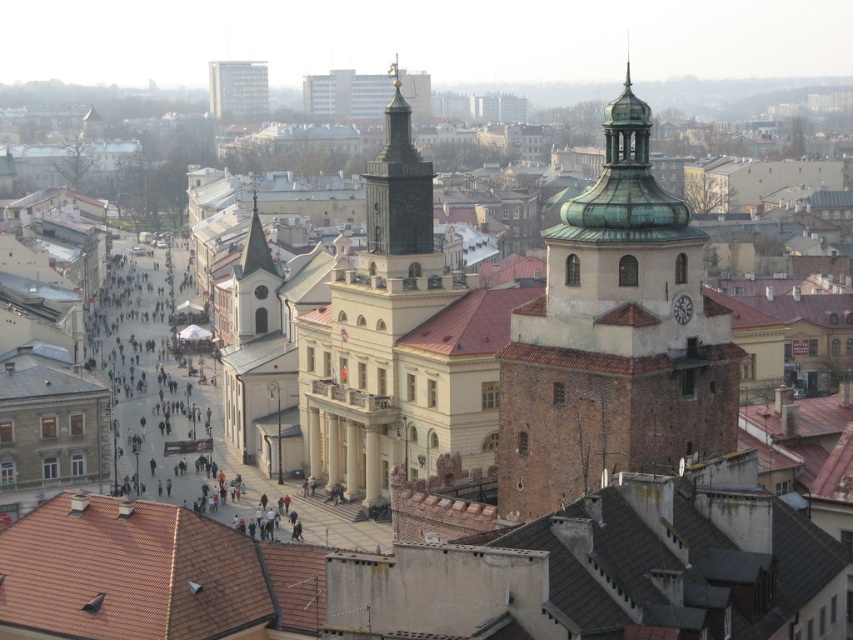
You are a tourist standing in the city square and want to take a photo of both the dark gray stone clock tower at center and the smooth white spire at upper left. Can you capture both in the same frame without moving your camera position?

Yes, the dark gray stone clock tower at center is in front of the smooth white spire at upper left, so you can include both in the same frame by positioning the clock tower in the foreground and the spire visible behind it.

You are an architect analyzing the cityscape. You notice the green copper dome at center right and the matte gray building at upper center. Which of these two structures has a more prominent visual presence in the scene?

The green copper dome at center right has a more prominent visual presence because it is larger in size than the matte gray building at upper center.

You are standing at the classical building with a clock tower and want to walk to the point marked as point (219, 104). However, there is an obstacle at point (370, 198). Will you encounter this obstacle before reaching your destination?

Yes, you will encounter the obstacle at point (370, 198) before reaching the destination at point (219, 104) because point (370, 198) is in front of point (219, 104).